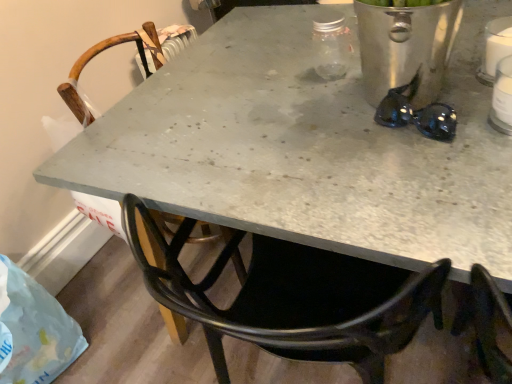
Question: In terms of width, does translucent plastic bag at lower left look wider or thinner when compared to black shiny sunglasses at upper right?

Choices:
 (A) thin
 (B) wide

Answer: (B)

Question: In terms of height, does translucent plastic bag at lower left look taller or shorter compared to black shiny sunglasses at upper right?

Choices:
 (A) short
 (B) tall

Answer: (B)

Question: Estimate the real-world distances between objects in this image. Which object is closer to the black shiny sunglasses at upper right?

Choices:
 (A) translucent plastic bag at lower left
 (B) white plastic bottle at upper right
 (C) wooden chair at center

Answer: (B)

Question: Based on their relative distances, which object is nearer to the black shiny sunglasses at upper right?

Choices:
 (A) white plastic bottle at upper right
 (B) wooden chair at center
 (C) translucent plastic bag at lower left

Answer: (A)